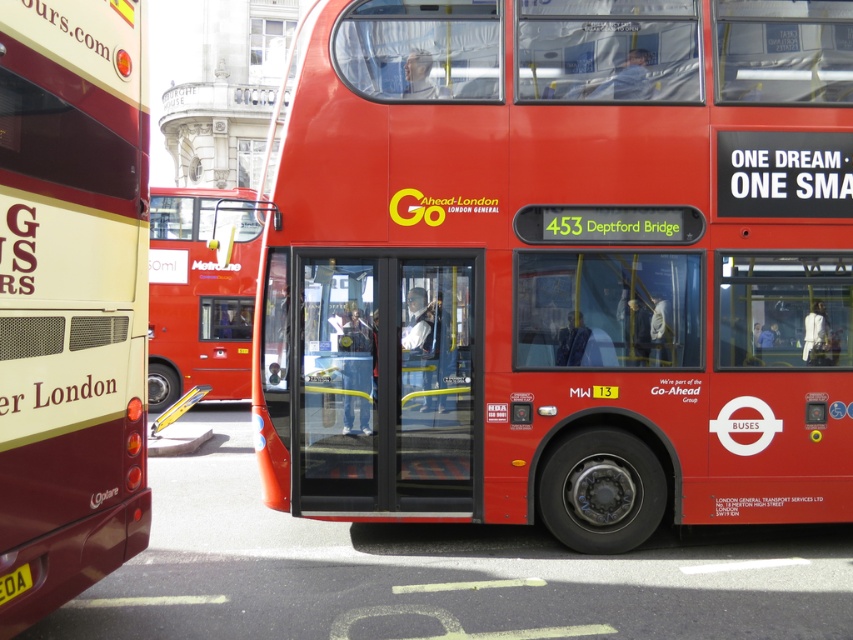
Question: Is shiny red bus at center above yellow plastic license plate at lower left?

Choices:
 (A) yes
 (B) no

Answer: (A)

Question: Is matte gold bus at left above yellow plastic license plate at lower left?

Choices:
 (A) yes
 (B) no

Answer: (A)

Question: Which of the following is the closest to the observer?

Choices:
 (A) (665, 484)
 (B) (238, 358)

Answer: (A)

Question: Is matte gold bus at left smaller than red matte bus at center?

Choices:
 (A) no
 (B) yes

Answer: (B)

Question: Which point is farther to the camera?

Choices:
 (A) (15, 573)
 (B) (235, 381)
 (C) (619, 531)
 (D) (80, 349)

Answer: (B)

Question: Which of the following is the farthest from the observer?

Choices:
 (A) yellow plastic license plate at lower left
 (B) matte gold bus at left
 (C) shiny red bus at center
 (D) red matte bus at center

Answer: (D)